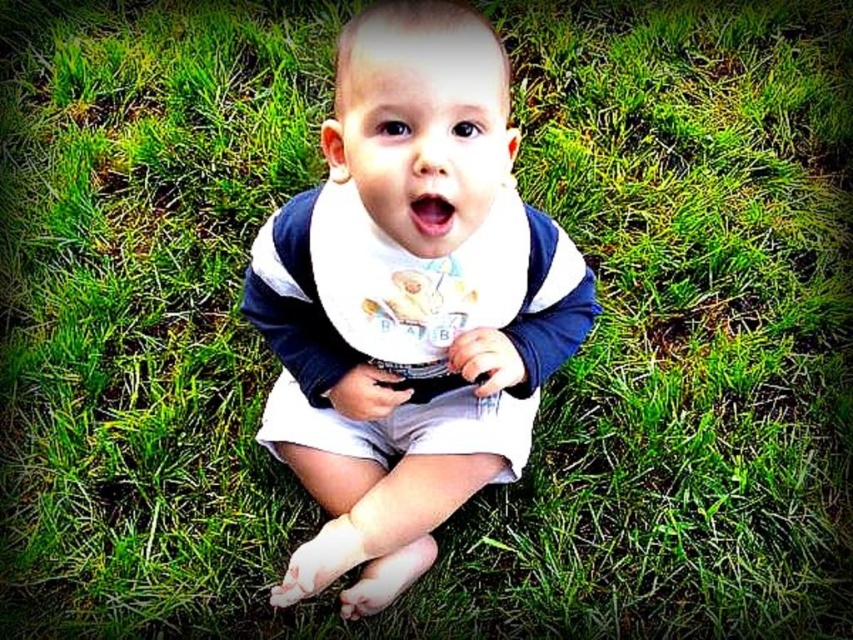
You are a photographer taking a picture of a baby wearing two bibs. The baby has a white soft bib at center and a white fabric bib at center. Which bib is positioned lower on the baby?

The white soft bib at center is located below the white fabric bib at center, so the white soft bib at center is positioned lower on the baby.

The baby is sitting on the grass. There is a point at coordinates (408,300). What is located at that point?

The white soft bib at center is located at point (408,300).